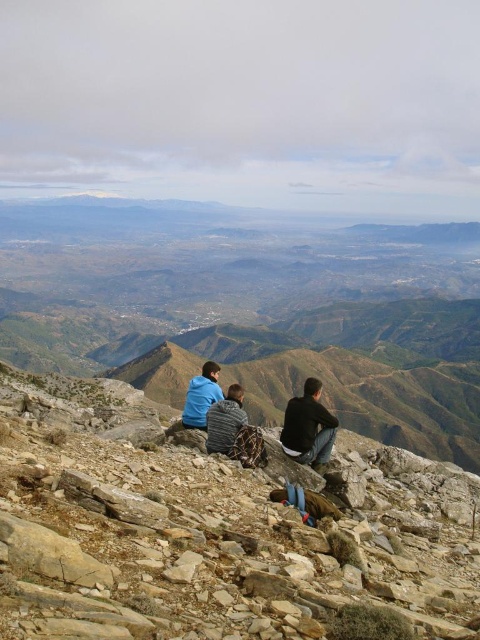
Question: Which of the following is the farthest from the observer?

Choices:
 (A) (220, 397)
 (B) (223, 406)
 (C) (204, 586)

Answer: (A)

Question: Which of the following is the closest to the observer?

Choices:
 (A) click(211, 440)
 (B) click(315, 429)
 (C) click(87, 387)
 (D) click(204, 401)

Answer: (A)

Question: Which of these objects is positioned closest to the brown rocky mountain at center?

Choices:
 (A) dark blue denim jacket at center
 (B) dark blue shirt at center

Answer: (A)

Question: Can you confirm if dark blue shirt at center is smaller than blue fabric jacket at lower left?

Choices:
 (A) yes
 (B) no

Answer: (A)

Question: Can you confirm if dark blue denim jacket at center is positioned to the left of blue fabric jacket at lower left?

Choices:
 (A) no
 (B) yes

Answer: (A)

Question: From the image, what is the correct spatial relationship of dark blue denim jacket at center in relation to dark blue shirt at center?

Choices:
 (A) below
 (B) above

Answer: (A)